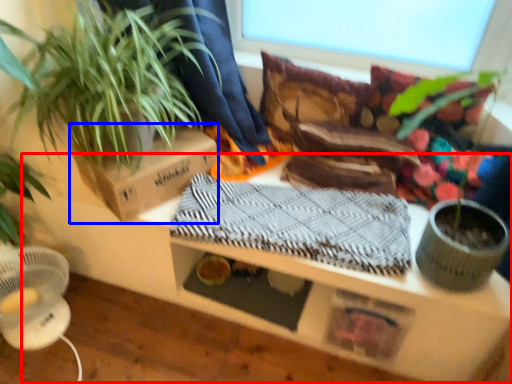
Question: Among these objects, which one is nearest to the camera, table (highlighted by a red box) or cardboard box (highlighted by a blue box)?

Choices:
 (A) table
 (B) cardboard box

Answer: (A)